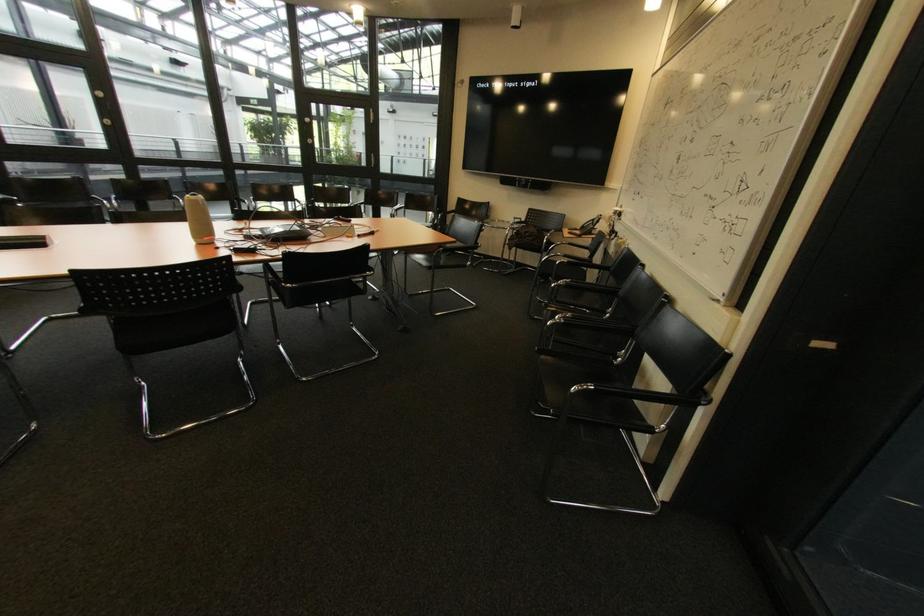
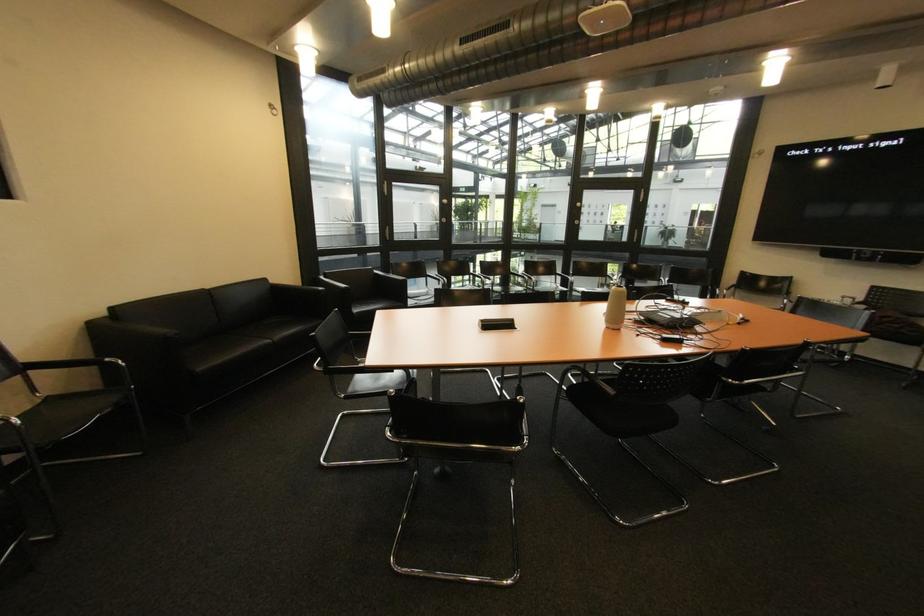
Question: What movement of the cameraman would produce the second image?

Choices:
 (A) Left
 (B) Right
 (C) Forward
 (D) Backward

Answer: (A)